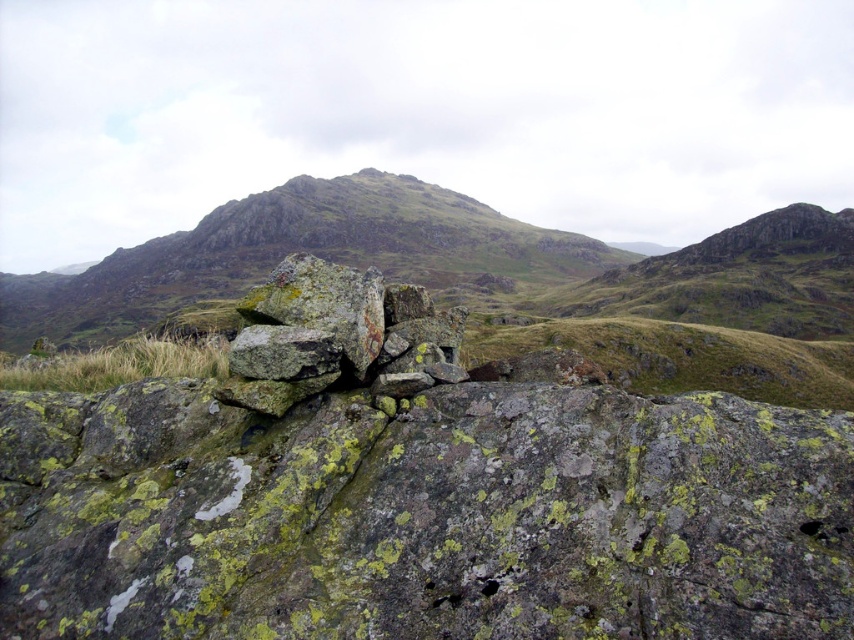
Question: Which object is closer to the camera taking this photo?

Choices:
 (A) rusty metallic pile at center
 (B) rusty stone boulders at center

Answer: (A)

Question: Can you confirm if rusty metallic pile at center is smaller than rusty stone boulders at center?

Choices:
 (A) yes
 (B) no

Answer: (A)

Question: Is the position of rusty metallic pile at center less distant than that of rusty stone boulders at center?

Choices:
 (A) no
 (B) yes

Answer: (B)

Question: Which point is closer to the camera?

Choices:
 (A) rusty stone boulders at center
 (B) rusty metallic pile at center

Answer: (B)

Question: Does rusty metallic pile at center have a larger size compared to rusty stone boulders at center?

Choices:
 (A) no
 (B) yes

Answer: (A)